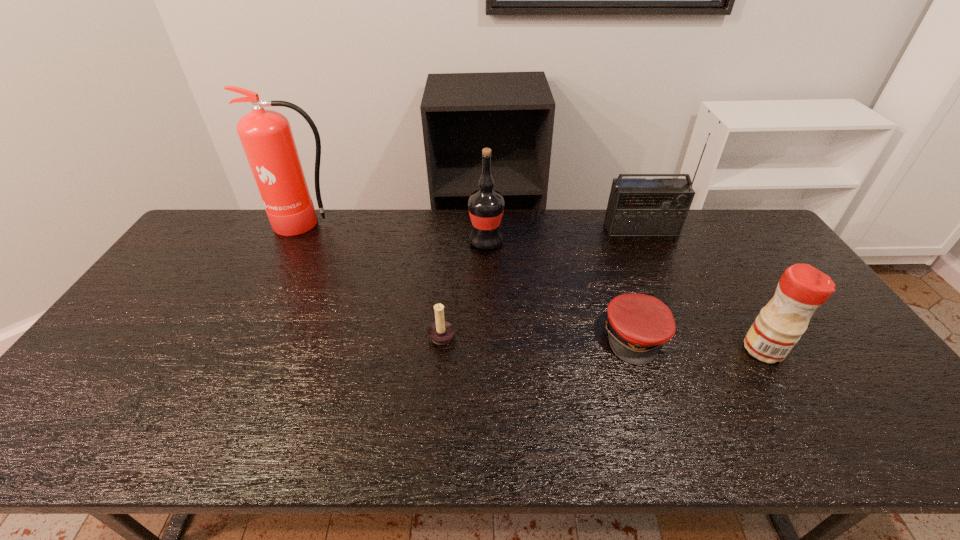
Where is `vacant space at the right edge`? This screenshot has height=540, width=960. vacant space at the right edge is located at coordinates (859, 356).

This screenshot has width=960, height=540. In the image, there is a desktop. What are the coordinates of `free space at the near left corner` in the screenshot? It's located at (99, 416).

At what (x,y) coordinates should I click in order to perform the action: click on free spot between the radio receiver and the wine bottle. Please return your answer as a coordinate pair (x, y). The width and height of the screenshot is (960, 540). Looking at the image, I should click on coord(564,235).

Identify the location of vacant area that lies between the fourth object from right to left and the radio receiver. tap(564, 235).

Locate an element on the screen. This screenshot has height=540, width=960. free space between the wine bottle and the radio receiver is located at coordinates (564, 235).

Identify the location of free space between the candle holder and the condiment. The image size is (960, 540). (603, 342).

The image size is (960, 540). Find the location of `free point between the shortest object and the radio receiver`. free point between the shortest object and the radio receiver is located at coordinates (638, 283).

Identify the location of empty location between the cap and the wine bottle. (561, 289).

The height and width of the screenshot is (540, 960). I want to click on free space that is in between the leftmost object and the third object from left to right, so click(396, 233).

The height and width of the screenshot is (540, 960). Find the location of `object that is the third nearest to the radio receiver`. object that is the third nearest to the radio receiver is located at coordinates (802, 288).